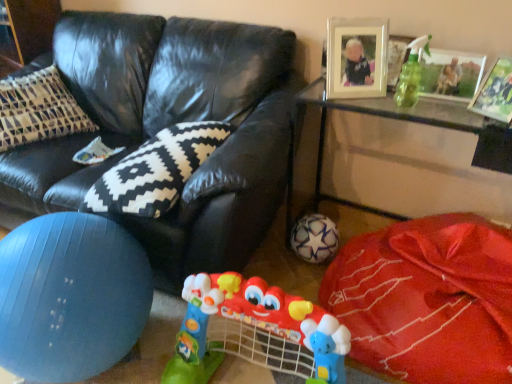
Question: From the image's perspective, does plastic colorful baby walker at center appear lower than wooden picture frame at upper right, which appears as the first picture frame when viewed from the left?

Choices:
 (A) no
 (B) yes

Answer: (B)

Question: Can you confirm if plastic colorful baby walker at center is thinner than wooden picture frame at upper right, acting as the 3th picture frame starting from the right?

Choices:
 (A) yes
 (B) no

Answer: (B)

Question: Could you tell me if plastic colorful baby walker at center is turned towards wooden picture frame at upper right, acting as the 3th picture frame starting from the right?

Choices:
 (A) no
 (B) yes

Answer: (A)

Question: From a real-world perspective, is plastic colorful baby walker at center under wooden picture frame at upper right, acting as the 3th picture frame starting from the right?

Choices:
 (A) yes
 (B) no

Answer: (A)

Question: Is wooden picture frame at upper right, which appears as the first picture frame when viewed from the left, completely or partially inside plastic colorful baby walker at center?

Choices:
 (A) yes
 (B) no

Answer: (B)

Question: Can you confirm if plastic colorful baby walker at center is shorter than wooden picture frame at upper right, which appears as the first picture frame when viewed from the left?

Choices:
 (A) yes
 (B) no

Answer: (B)

Question: From the image's perspective, is metallic silver picture frame at upper right, which appears as the second picture frame when viewed from the right, on blue rubber ball at lower left?

Choices:
 (A) yes
 (B) no

Answer: (A)

Question: Is metallic silver picture frame at upper right, which appears as the second picture frame when viewed from the right, positioned in front of blue rubber ball at lower left?

Choices:
 (A) yes
 (B) no

Answer: (B)

Question: Can you confirm if metallic silver picture frame at upper right, which appears as the second picture frame when viewed from the right, is positioned to the right of blue rubber ball at lower left?

Choices:
 (A) yes
 (B) no

Answer: (A)

Question: Is metallic silver picture frame at upper right, the second picture frame viewed from the left, touching blue rubber ball at lower left?

Choices:
 (A) no
 (B) yes

Answer: (A)

Question: Can you confirm if metallic silver picture frame at upper right, which appears as the second picture frame when viewed from the right, is shorter than blue rubber ball at lower left?

Choices:
 (A) no
 (B) yes

Answer: (B)

Question: Is metallic silver picture frame at upper right, which appears as the second picture frame when viewed from the right, positioned beyond the bounds of blue rubber ball at lower left?

Choices:
 (A) yes
 (B) no

Answer: (A)

Question: Considering the relative positions of black leather couch at center and metallic silver picture frame at upper right, the second picture frame viewed from the left, in the image provided, is black leather couch at center in front of metallic silver picture frame at upper right, the second picture frame viewed from the left,?

Choices:
 (A) yes
 (B) no

Answer: (A)